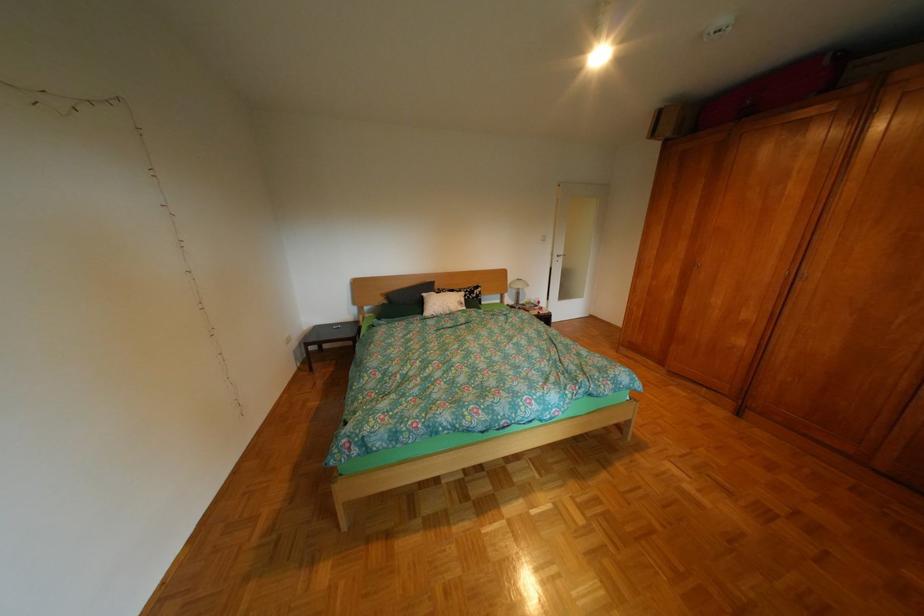
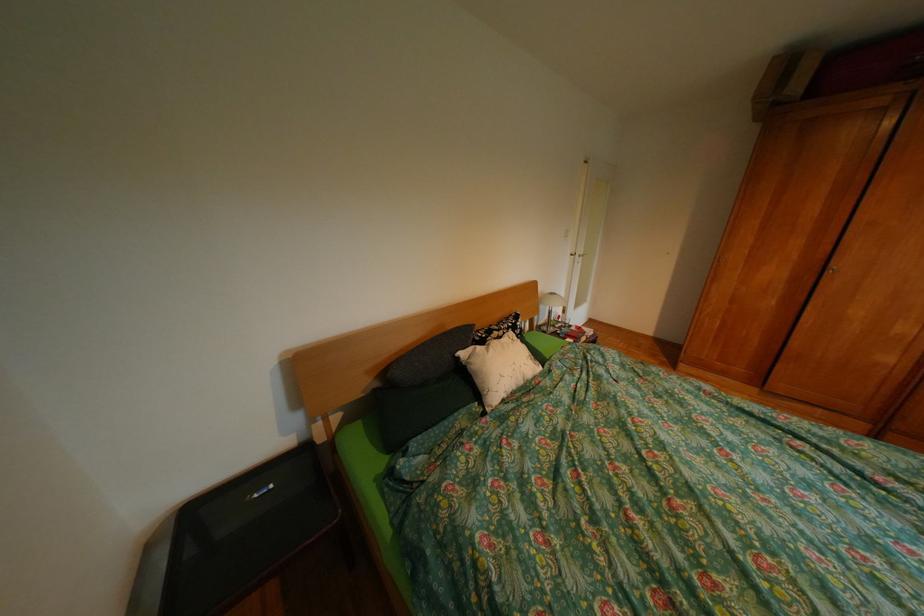
Find the pixel in the second image that matches (439,294) in the first image.

(477, 354)